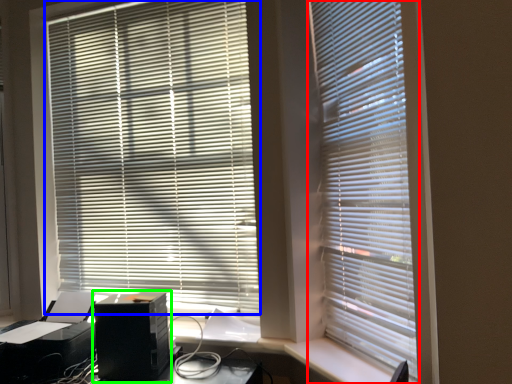
Question: Which is nearer to the window blind (highlighted by a red box)? window blind (highlighted by a blue box) or computer tower (highlighted by a green box).

Choices:
 (A) window blind
 (B) computer tower

Answer: (A)